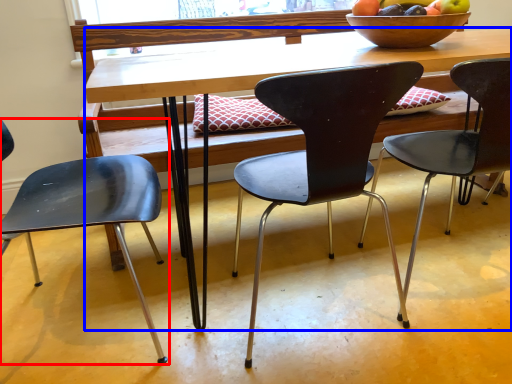
Question: Which object is further to the camera taking this photo, chair (highlighted by a red box) or desk (highlighted by a blue box)?

Choices:
 (A) chair
 (B) desk

Answer: (B)